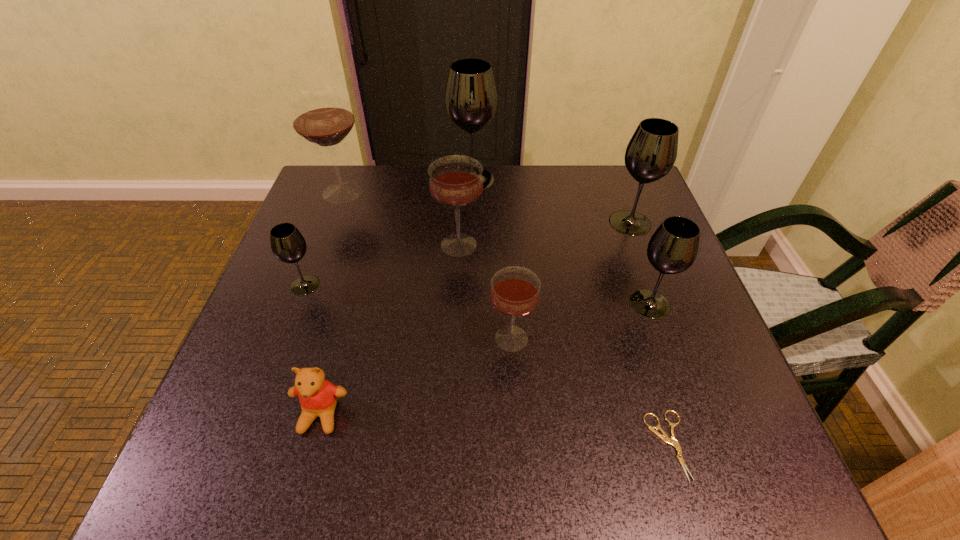
I want to click on the tallest wineglass, so (x=471, y=97).

The height and width of the screenshot is (540, 960). Identify the location of the biggest gray wineglass. (471, 97).

The width and height of the screenshot is (960, 540). Identify the location of the biggest red wineglass. (322, 115).

At what (x,y) coordinates should I click in order to perform the action: click on the farthest red wineglass. Please return your answer as a coordinate pair (x, y). Image resolution: width=960 pixels, height=540 pixels. Looking at the image, I should click on (322, 115).

Identify the location of the second farthest gray wineglass. (651, 153).

Identify the location of the second farthest red wineglass. (455, 182).

Locate an element on the screen. the second red wineglass from left to right is located at coordinates (455, 182).

Where is `the second smallest gray wineglass`? This screenshot has width=960, height=540. the second smallest gray wineglass is located at coordinates (672, 249).

Identify the location of the rightmost red wineglass. Image resolution: width=960 pixels, height=540 pixels. (515, 291).

Identify the location of the nearest red wineglass. (515, 291).